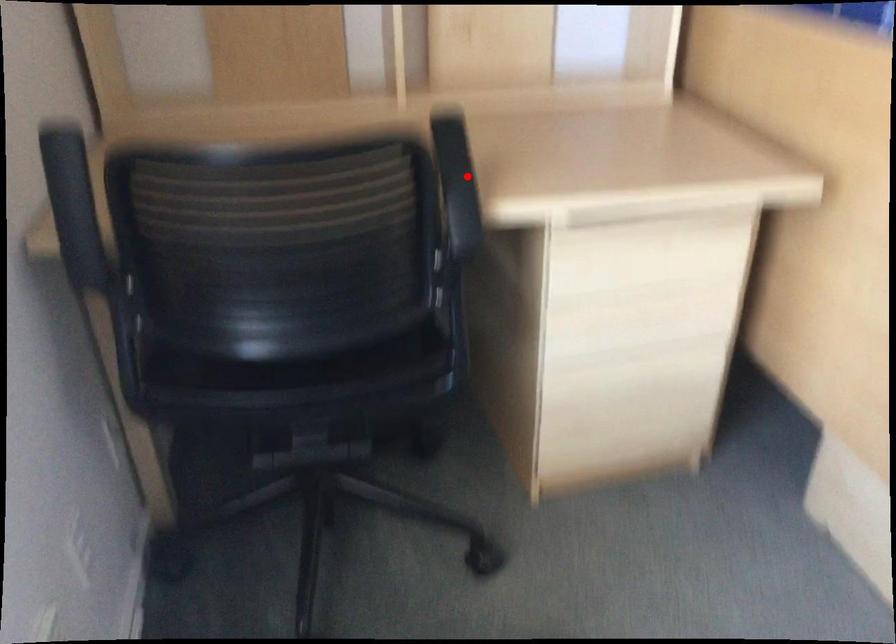
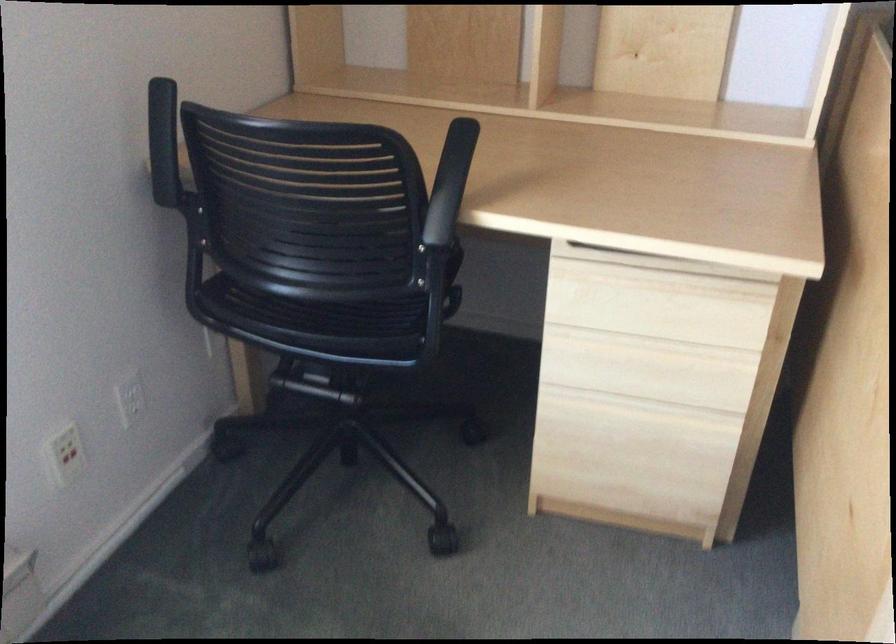
Where in the second image is the point corresponding to the highlighted location from the first image?

(450, 183)